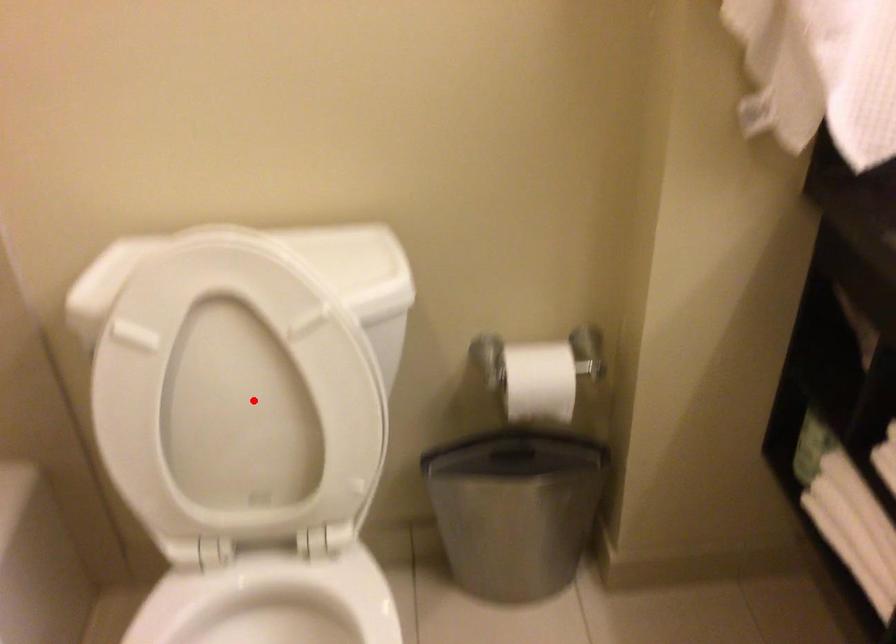
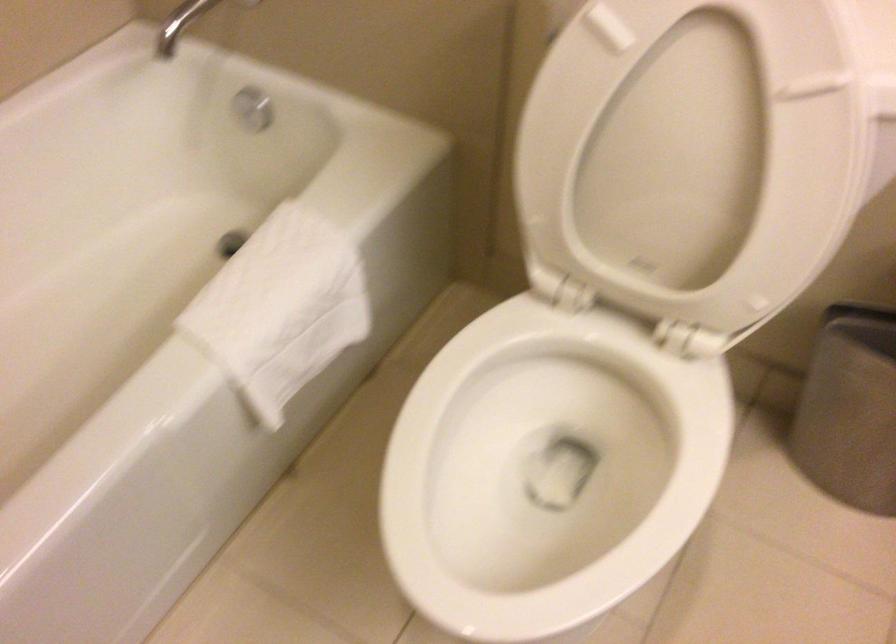
Locate, in the second image, the point that corresponds to the highlighted location in the first image.

(691, 154)